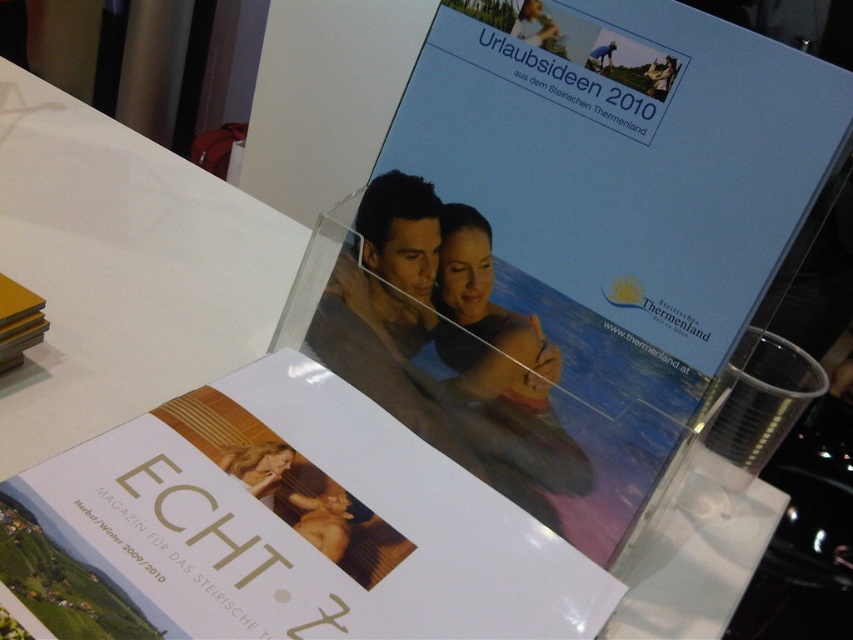
Question: Among these objects, which one is nearest to the camera?

Choices:
 (A) blue glossy booklet at upper center
 (B) blonde hair at center

Answer: (A)

Question: Does white glossy book at center have a lesser width compared to blonde hair at center?

Choices:
 (A) no
 (B) yes

Answer: (A)

Question: Which is nearer to the white paper at upper left?

Choices:
 (A) yellow matte book at upper left
 (B) blue glossy booklet at upper center

Answer: (A)

Question: Which point is farther to the camera?

Choices:
 (A) white glossy book at center
 (B) blonde hair at center
 (C) blue glossy booklet at upper center
 (D) white paper at upper left

Answer: (D)

Question: Does white glossy book at center appear on the left side of yellow matte book at upper left?

Choices:
 (A) yes
 (B) no

Answer: (B)

Question: Can you confirm if white glossy book at center is bigger than yellow matte book at upper left?

Choices:
 (A) no
 (B) yes

Answer: (B)